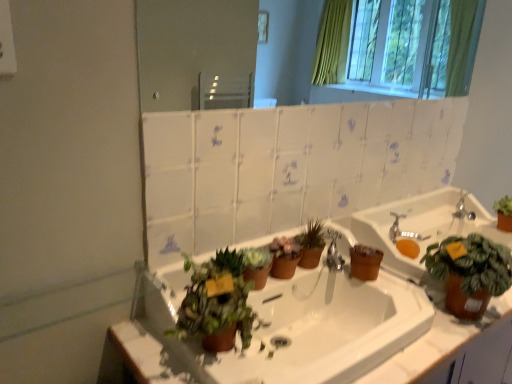
Question: Considering the relative sizes of green matte plant at lower center, the 4th houseplant positioned from the right, and matte white mirror at upper center in the image provided, is green matte plant at lower center, the 4th houseplant positioned from the right, taller than matte white mirror at upper center?

Choices:
 (A) no
 (B) yes

Answer: (A)

Question: From a real-world perspective, is green matte plant at lower center, the 4th houseplant positioned from the right, on matte white mirror at upper center?

Choices:
 (A) yes
 (B) no

Answer: (B)

Question: Can you confirm if green matte plant at lower center, marked as the first houseplant in a left-to-right arrangement, is thinner than matte white mirror at upper center?

Choices:
 (A) yes
 (B) no

Answer: (B)

Question: From a real-world perspective, is green matte plant at lower center, marked as the first houseplant in a left-to-right arrangement, below matte white mirror at upper center?

Choices:
 (A) no
 (B) yes

Answer: (B)

Question: Is the surface of green matte plant at lower center, marked as the first houseplant in a left-to-right arrangement, in direct contact with matte white mirror at upper center?

Choices:
 (A) yes
 (B) no

Answer: (B)

Question: Considering the positions of green matte plant at center, placed as the 3th houseplant when sorted from right to left, and matte brown pot at center, the 2th houseplant positioned from the right, in the image, is green matte plant at center, placed as the 3th houseplant when sorted from right to left, taller or shorter than matte brown pot at center, the 2th houseplant positioned from the right,?

Choices:
 (A) short
 (B) tall

Answer: (A)

Question: Relative to matte brown pot at center, arranged as the 3th houseplant when viewed from the left, is green matte plant at center, placed as the 3th houseplant when sorted from right to left, in front or behind?

Choices:
 (A) behind
 (B) front

Answer: (B)

Question: From the image's perspective, is green matte plant at center, placed as the 3th houseplant when sorted from right to left, located above or below matte brown pot at center, arranged as the 3th houseplant when viewed from the left?

Choices:
 (A) above
 (B) below

Answer: (B)

Question: Is green matte plant at center, which ranks as the 2th houseplant in left-to-right order, spatially inside matte brown pot at center, the 2th houseplant positioned from the right, or outside of it?

Choices:
 (A) inside
 (B) outside

Answer: (B)

Question: In terms of size, does silver metallic faucet at upper right appear bigger or smaller than matte white mirror at upper center?

Choices:
 (A) small
 (B) big

Answer: (A)

Question: From the image's perspective, is silver metallic faucet at upper right located above or below matte white mirror at upper center?

Choices:
 (A) above
 (B) below

Answer: (B)

Question: Relative to matte white mirror at upper center, is silver metallic faucet at upper right in front or behind?

Choices:
 (A) behind
 (B) front

Answer: (A)

Question: Considering the relative positions of silver metallic faucet at upper right and matte white mirror at upper center in the image provided, is silver metallic faucet at upper right to the left or to the right of matte white mirror at upper center?

Choices:
 (A) right
 (B) left

Answer: (A)

Question: Is point (472, 216) positioned closer to the camera than point (314, 220)?

Choices:
 (A) closer
 (B) farther

Answer: (B)

Question: Is silver metallic faucet at upper right in front of or behind matte brown pot at center, arranged as the 3th houseplant when viewed from the left, in the image?

Choices:
 (A) front
 (B) behind

Answer: (B)